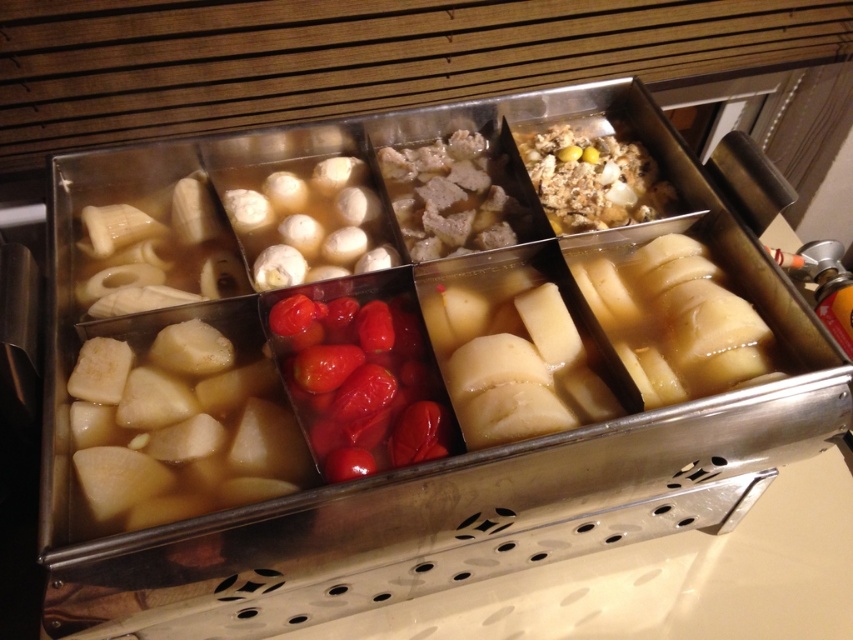
Question: Among these objects, which one is farthest from the camera?

Choices:
 (A) white translucent potatoes at lower left
 (B) white matte dumplings at center
 (C) shiny red tomatoes at center

Answer: (B)

Question: Estimate the real-world distances between objects in this image. Which object is closer to the brown meat at center?

Choices:
 (A) shiny red tomatoes at center
 (B) brown crumbly mixture at upper right

Answer: (B)

Question: Is shiny red tomatoes at center bigger than brown meat at center?

Choices:
 (A) yes
 (B) no

Answer: (B)

Question: Where is white translucent potatoes at lower left located in relation to white matte dumplings at center in the image?

Choices:
 (A) below
 (B) above

Answer: (A)

Question: Does white translucent potatoes at lower left have a smaller size compared to brown meat at center?

Choices:
 (A) no
 (B) yes

Answer: (A)

Question: Which of the following is the farthest from the observer?

Choices:
 (A) (412, 424)
 (B) (651, 212)
 (C) (175, 508)

Answer: (B)